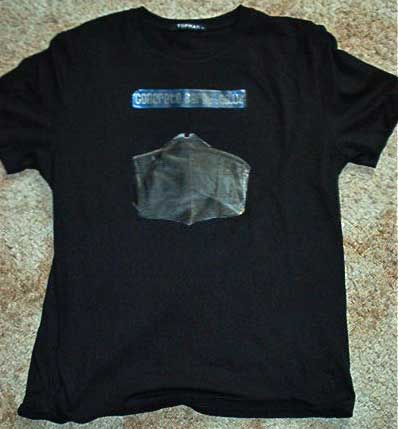
The image size is (398, 429). I want to click on carpet, so click(x=378, y=30).